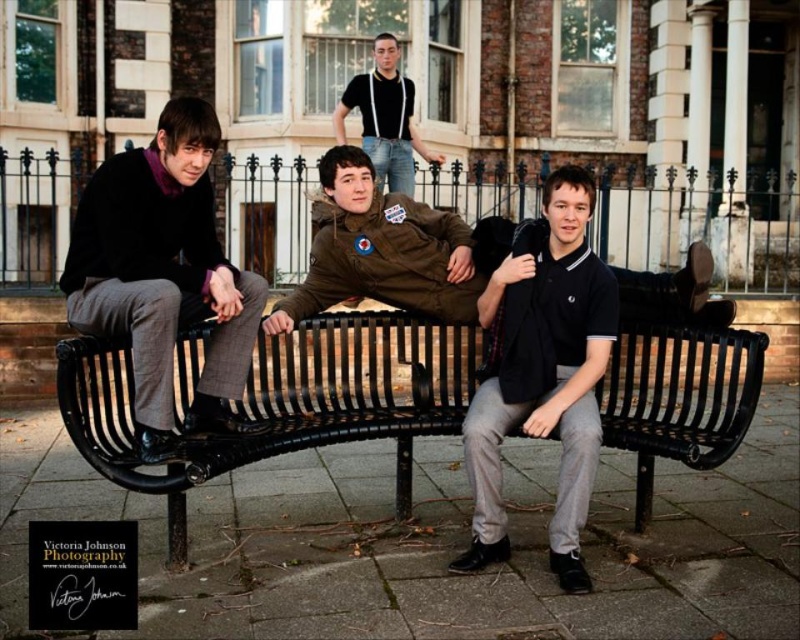
Question: Which point is farther to the camera?

Choices:
 (A) (500, 513)
 (B) (386, 76)
 (C) (120, 403)
 (D) (172, 260)

Answer: (B)

Question: Which of the following is the closest to the observer?

Choices:
 (A) black metal bench at center
 (B) matte black sweater at left
 (C) black cotton polo shirt at center
 (D) matte black t-shirt at upper center

Answer: (A)

Question: In this image, where is matte black sweater at left located relative to matte black t-shirt at upper center?

Choices:
 (A) above
 (B) below

Answer: (B)

Question: Among these points, which one is farthest from the camera?

Choices:
 (A) (602, 316)
 (B) (682, 349)

Answer: (B)

Question: Observing the image, what is the correct spatial positioning of matte black sweater at left in reference to black cotton polo shirt at center?

Choices:
 (A) right
 (B) left

Answer: (B)

Question: Is black metal bench at center thinner than matte black sweater at left?

Choices:
 (A) no
 (B) yes

Answer: (A)